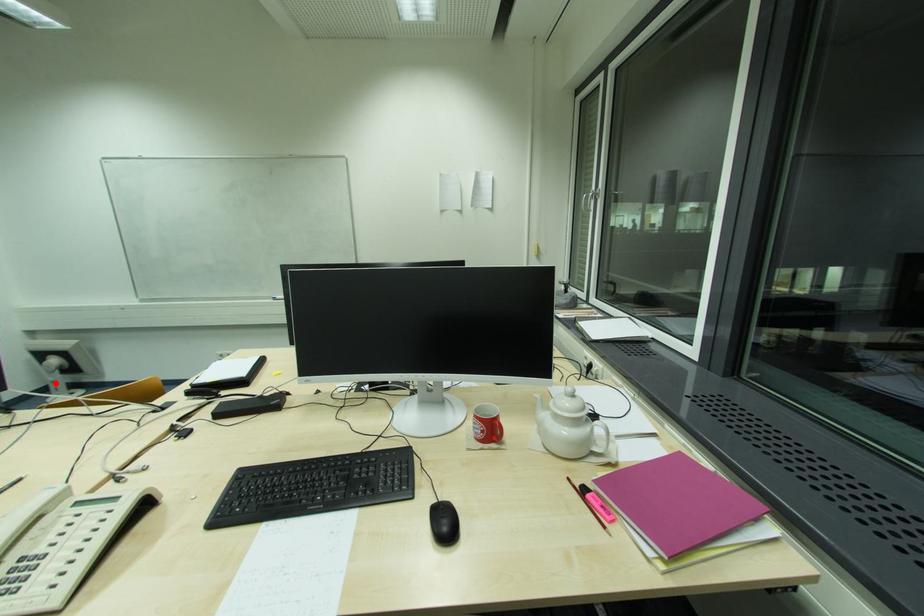
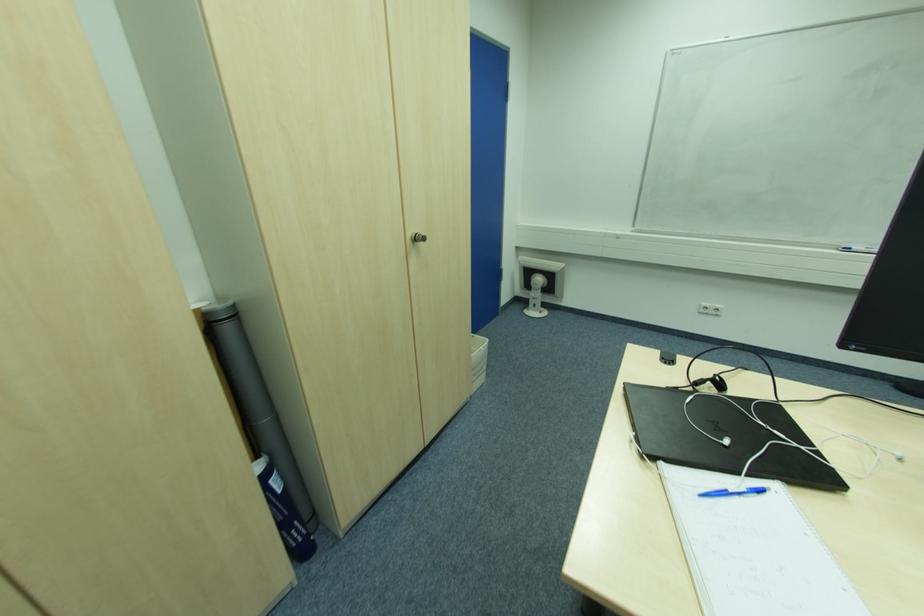
Question: I am providing you with two images of the same scene from different viewpoints. A red point is shown in image1. For the corresponding object point in image2, is it positioned nearer or farther from the camera?

Choices:
 (A) Nearer
 (B) Farther

Answer: (A)